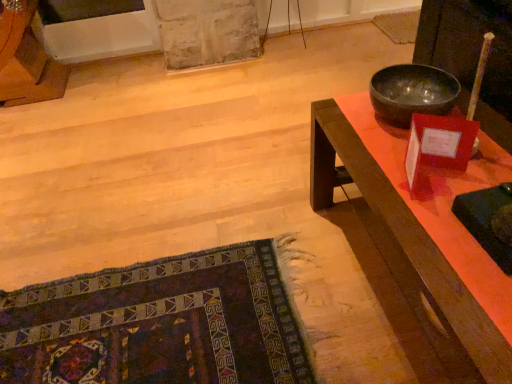
Locate an element on the screen. This screenshot has width=512, height=384. vacant space that is in between wooden desk at right and dark woven rug at lower left is located at coordinates (315, 258).